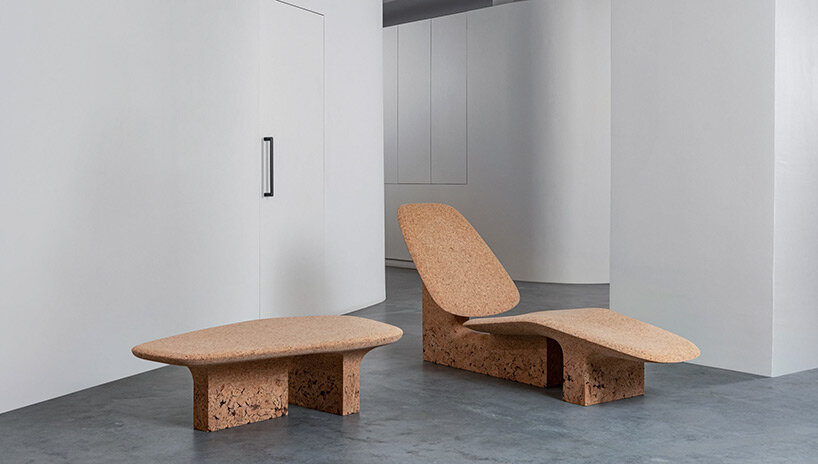
The image size is (818, 464). Find the location of `chair's shadow`. chair's shadow is located at coordinates tap(309, 288).